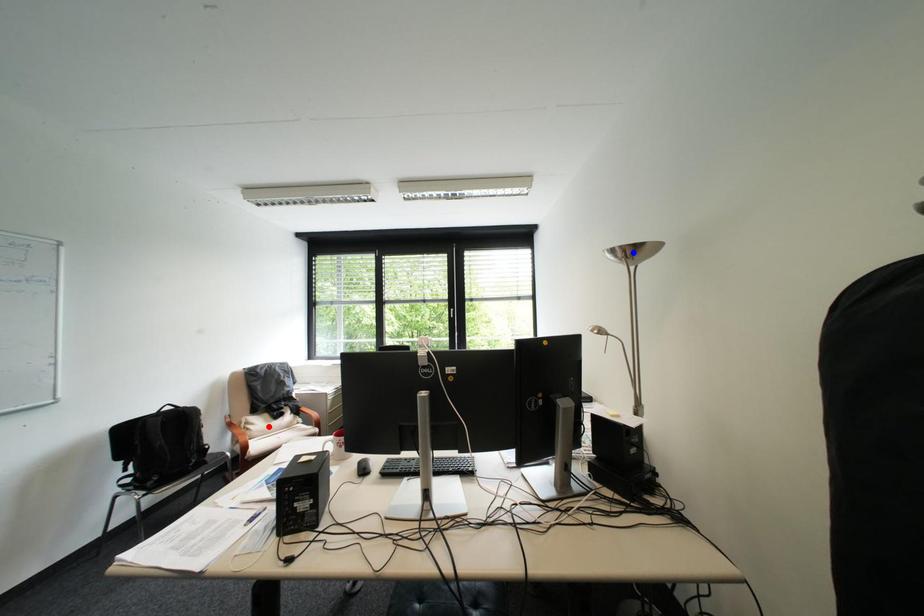
Question: In the image, two points are highlighted. Which point is nearer to the camera? Reply with the corresponding letter.

Choices:
 (A) blue point
 (B) red point

Answer: (A)